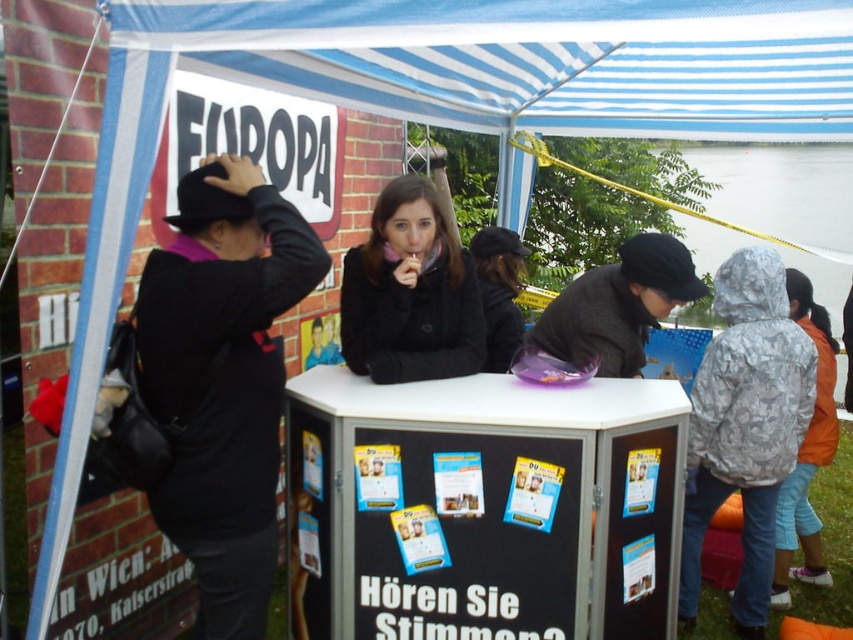
In the scene shown: Does camouflage-patterned jacket at lower right appear on the left side of black matte coat at center?

In fact, camouflage-patterned jacket at lower right is to the right of black matte coat at center.

Which is below, camouflage-patterned jacket at lower right or black matte coat at center?

camouflage-patterned jacket at lower right is lower down.

Between point (715, 289) and point (444, 260), which one is positioned in front?

Positioned in front is point (444, 260).

Identify the location of camouflage-patterned jacket at lower right. (746, 426).

Between blue striped canopy at upper center and black matte coat at center, which one is positioned higher?

Positioned higher is blue striped canopy at upper center.

Is point (787, 115) behind point (396, 337)?

Yes, point (787, 115) is farther from viewer.

Find the location of a particular element. blue striped canopy at upper center is located at coordinates (531, 60).

Measure the distance between black plastic table at center and camera.

7.35 feet

Does black plastic table at center appear under camouflage-patterned jacket at lower right?

Indeed, black plastic table at center is positioned under camouflage-patterned jacket at lower right.

Is point (386, 454) closer to camera compared to point (730, 472)?

Yes, point (386, 454) is in front of point (730, 472).

Find the location of a particular element. The width and height of the screenshot is (853, 640). black plastic table at center is located at coordinates (483, 508).